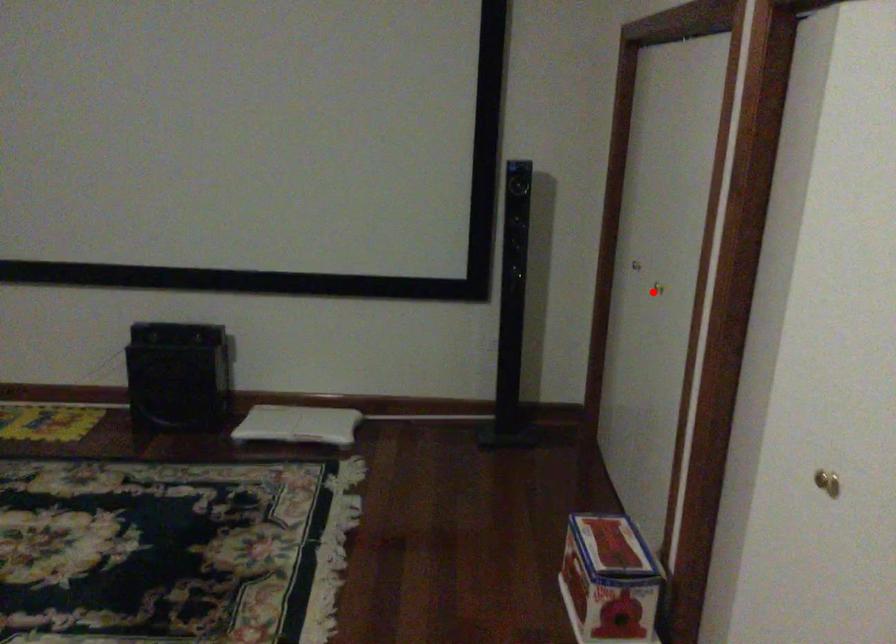
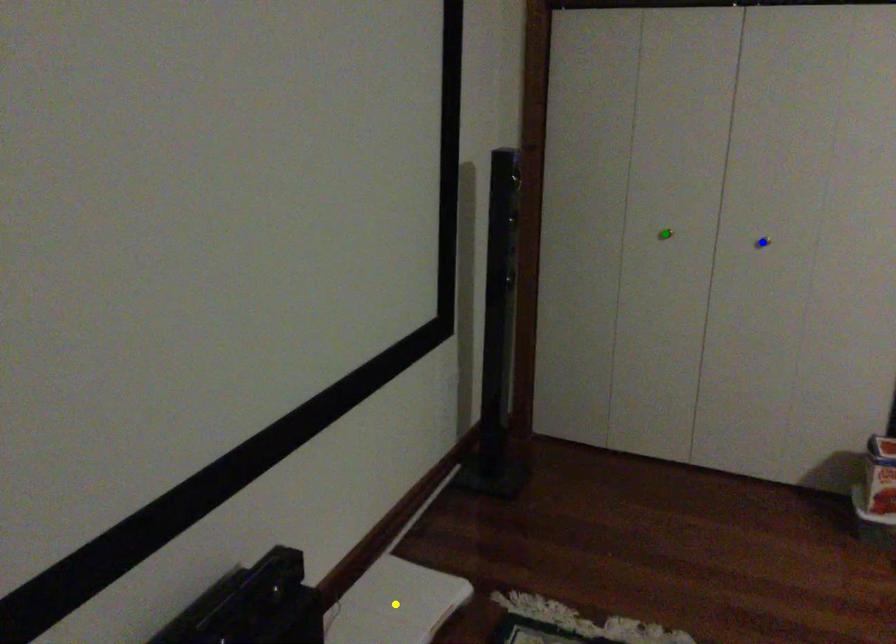
Question: I am providing you with two images of the same scene from different viewpoints. A red point is marked on the first image. You are given multiple points on the second image. Which point in image 2 is actually the same real-world point as the red point in image 1?

Choices:
 (A) yellow point
 (B) blue point
 (C) green point

Answer: (B)